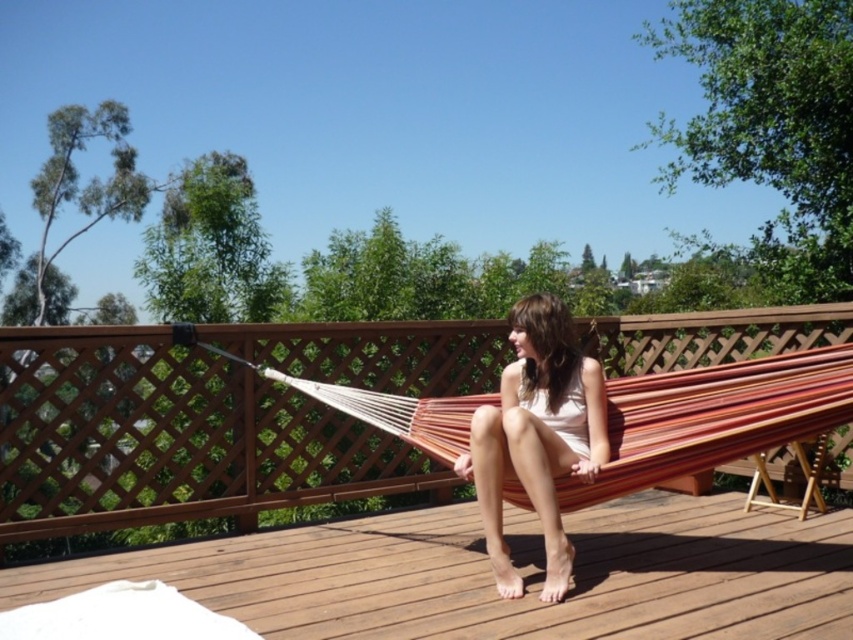
Question: Which point appears farthest from the camera in this image?

Choices:
 (A) (547, 332)
 (B) (498, 600)
 (C) (265, 420)

Answer: (C)

Question: Which object appears closest to the camera in this image?

Choices:
 (A) matte beige dress at center
 (B) natural wood hammock at center

Answer: (A)

Question: Can you confirm if natural wood hammock at center is thinner than matte beige dress at center?

Choices:
 (A) yes
 (B) no

Answer: (B)

Question: Can you confirm if wooden deck at center is positioned below matte beige dress at center?

Choices:
 (A) no
 (B) yes

Answer: (B)

Question: Which of the following is the farthest from the observer?

Choices:
 (A) natural wood hammock at center
 (B) matte beige dress at center

Answer: (A)

Question: Is wooden deck at center wider than matte beige dress at center?

Choices:
 (A) yes
 (B) no

Answer: (A)